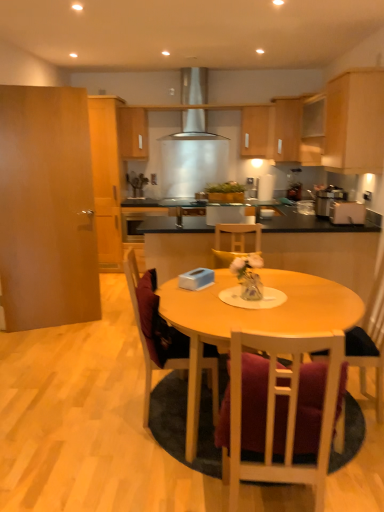
Locate an element on the screen. vacant point above light wood table at center (from a real-world perspective) is located at coordinates (259, 307).